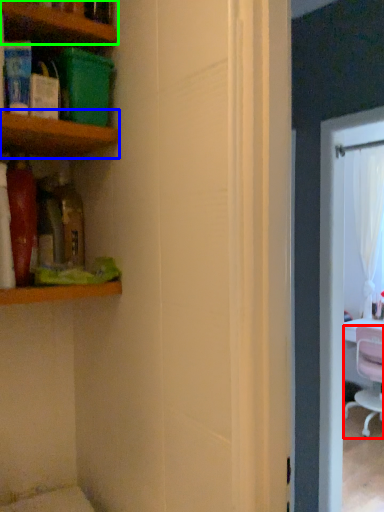
Question: Based on their relative distances, which object is farther from chair (highlighted by a red box)? Choose from shelf (highlighted by a blue box) and shelf (highlighted by a green box).

Choices:
 (A) shelf
 (B) shelf

Answer: (B)